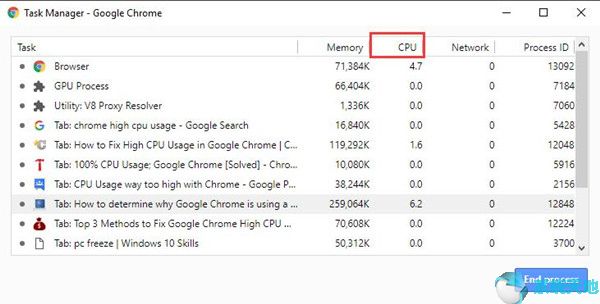
Identify the location of columns. The width and height of the screenshot is (600, 304). (107, 43), (321, 47), (409, 49), (463, 50), (541, 50).